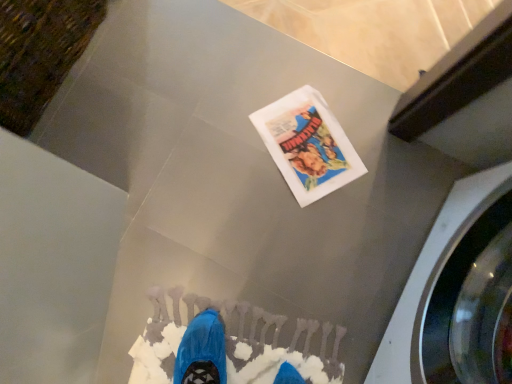
What are the coordinates of `vacant space underneath white paper flyer at center (from a real-world perspective)` in the screenshot? It's located at (311, 144).